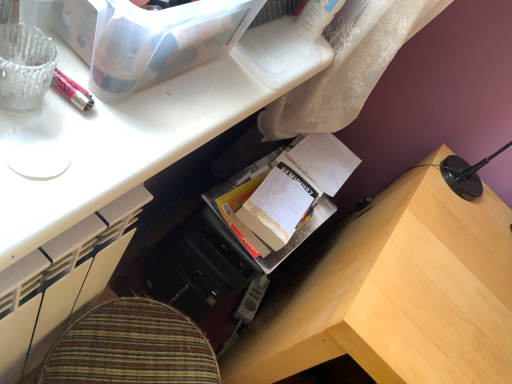
This screenshot has height=384, width=512. What do you see at coordinates (212, 258) in the screenshot? I see `cardboard book at center` at bounding box center [212, 258].

This screenshot has height=384, width=512. Find the location of `white paper notebook at center`. white paper notebook at center is located at coordinates (247, 199).

The height and width of the screenshot is (384, 512). Describe the element at coordinates (394, 294) in the screenshot. I see `wooden desk at lower right` at that location.

What is the approximate width of wooden desk at lower right?

wooden desk at lower right is 28.12 inches wide.

The image size is (512, 384). What do you see at coordinates (25, 66) in the screenshot? I see `translucent glass pen at upper left` at bounding box center [25, 66].

The height and width of the screenshot is (384, 512). What are the coordinates of `cardboard book at center` in the screenshot? It's located at (212, 258).

From the picture: Is translucent glass pen at upper left shorter than wooden desk at lower right?

Correct, translucent glass pen at upper left is not as tall as wooden desk at lower right.

Is translucent glass pen at upper left wider than wooden desk at lower right?

In fact, translucent glass pen at upper left might be narrower than wooden desk at lower right.

Is translucent glass pen at upper left to the left of wooden desk at lower right from the viewer's perspective?

Yes, translucent glass pen at upper left is to the left of wooden desk at lower right.

Can you confirm if transparent plastic storage box at upper left is positioned to the right of translucent glass pen at upper left?

Correct, you'll find transparent plastic storage box at upper left to the right of translucent glass pen at upper left.

Considering the sizes of transparent plastic storage box at upper left and translucent glass pen at upper left in the image, is transparent plastic storage box at upper left taller or shorter than translucent glass pen at upper left?

transparent plastic storage box at upper left is taller than translucent glass pen at upper left.

Is transparent plastic storage box at upper left not within translucent glass pen at upper left?

transparent plastic storage box at upper left is positioned outside translucent glass pen at upper left.

Would you say transparent plastic storage box at upper left is a long distance from translucent glass pen at upper left?

No.

What's the angular difference between translucent glass pen at upper left and wooden desk at center's facing directions?

0.472 degrees separate the facing orientations of translucent glass pen at upper left and wooden desk at center.

Considering the relative sizes of translucent glass pen at upper left and wooden desk at center in the image provided, is translucent glass pen at upper left taller than wooden desk at center?

Correct, translucent glass pen at upper left is much taller as wooden desk at center.

Is the depth of translucent glass pen at upper left less than that of wooden desk at center?

No, translucent glass pen at upper left is further to the viewer.

How far apart are translucent glass pen at upper left and wooden desk at center?

translucent glass pen at upper left and wooden desk at center are 11.56 inches apart.

From the image's perspective, would you say translucent glass pen at upper left is positioned over cardboard book at center?

Yes, from the image's perspective, translucent glass pen at upper left is above cardboard book at center.

Looking at their sizes, would you say translucent glass pen at upper left is wider or thinner than cardboard book at center?

Clearly, translucent glass pen at upper left has less width compared to cardboard book at center.

Looking at this image, considering the positions of objects translucent glass pen at upper left and cardboard book at center in the image provided, who is more to the left, translucent glass pen at upper left or cardboard book at center?

Positioned to the left is translucent glass pen at upper left.

From a real-world perspective, relative to cardboard book at center, is translucent glass pen at upper left vertically above or below?

Clearly, from a real-world perspective, translucent glass pen at upper left is above cardboard book at center.

From a real-world perspective, is transparent plastic storage box at upper left positioned over white paper notebook at center based on gravity?

Indeed, from a real-world perspective, transparent plastic storage box at upper left stands above white paper notebook at center.

Who is taller, transparent plastic storage box at upper left or white paper notebook at center?

transparent plastic storage box at upper left.

Is the surface of transparent plastic storage box at upper left in direct contact with white paper notebook at center?

No, transparent plastic storage box at upper left is not beside white paper notebook at center.

Could you tell me if transparent plastic storage box at upper left is facing white paper notebook at center?

No, transparent plastic storage box at upper left is not aimed at white paper notebook at center.

The image size is (512, 384). In order to click on storage box above the white paper notebook at center (from the image's perspective) in this screenshot , I will do `click(149, 39)`.

How many degrees apart are the facing directions of white paper notebook at center and transparent plastic storage box at upper left?

92.1 degrees.

Relative to transparent plastic storage box at upper left, is white paper notebook at center in front or behind?

white paper notebook at center is positioned farther from the viewer than transparent plastic storage box at upper left.

Is translucent glass pen at upper left next to transparent plastic storage box at upper left and touching it?

They are not placed beside each other.

Is translucent glass pen at upper left looking in the opposite direction of transparent plastic storage box at upper left?

That's not correct — translucent glass pen at upper left is not looking away from transparent plastic storage box at upper left.

From a real-world perspective, is translucent glass pen at upper left located higher than transparent plastic storage box at upper left?

No.

At what (x,y) coordinates should I click in order to perform the action: click on stationery on the left of the wooden desk at lower right. Please return your answer as a coordinate pair (x, y). The image size is (512, 384). Looking at the image, I should click on (25, 66).

Where is `stationery below the transparent plastic storage box at upper left (from a real-world perspective)`? Image resolution: width=512 pixels, height=384 pixels. stationery below the transparent plastic storage box at upper left (from a real-world perspective) is located at coordinates (25, 66).

From the image, which object appears to be farther from translucent glass pen at upper left, wooden desk at lower right or transparent plastic storage box at upper left?

wooden desk at lower right is positioned further to the anchor translucent glass pen at upper left.

Estimate the real-world distances between objects in this image. Which object is closer to translucent glass pen at upper left, white paper notebook at center or wooden desk at center?

wooden desk at center lies closer to translucent glass pen at upper left than the other object.

From the picture: Which object lies nearer to the anchor point translucent glass pen at upper left, wooden desk at center or cardboard book at center?

wooden desk at center lies closer to translucent glass pen at upper left than the other object.

Which object lies further to the anchor point cardboard book at center, translucent glass pen at upper left or wooden desk at lower right?

Based on the image, translucent glass pen at upper left appears to be further to cardboard book at center.

Which object lies further to the anchor point wooden desk at center, cardboard book at center or translucent glass pen at upper left?

Based on the image, cardboard book at center appears to be further to wooden desk at center.

When comparing their distances from translucent glass pen at upper left, does wooden desk at center or transparent plastic storage box at upper left seem closer?

The object closer to translucent glass pen at upper left is transparent plastic storage box at upper left.

Considering their positions, is transparent plastic storage box at upper left positioned further to wooden desk at center than white paper notebook at center?

white paper notebook at center is further to wooden desk at center.

Based on their spatial positions, is transparent plastic storage box at upper left or white paper notebook at center further from wooden desk at lower right?

Among the two, transparent plastic storage box at upper left is located further to wooden desk at lower right.

Locate an element on the screen. Image resolution: width=512 pixels, height=384 pixels. storage box between wooden desk at center and white paper notebook at center in the front-back direction is located at coordinates [149, 39].

Find the location of a particular element. book between transparent plastic storage box at upper left and wooden desk at lower right vertically is located at coordinates (247, 199).

This screenshot has height=384, width=512. Find the location of `book between transparent plastic storage box at upper left and cardboard book at center along the z-axis`. book between transparent plastic storage box at upper left and cardboard book at center along the z-axis is located at coordinates (247, 199).

Identify the location of stationery between wooden desk at center and white paper notebook at center along the z-axis. (25, 66).